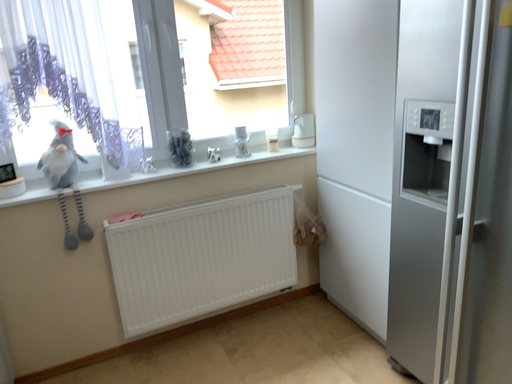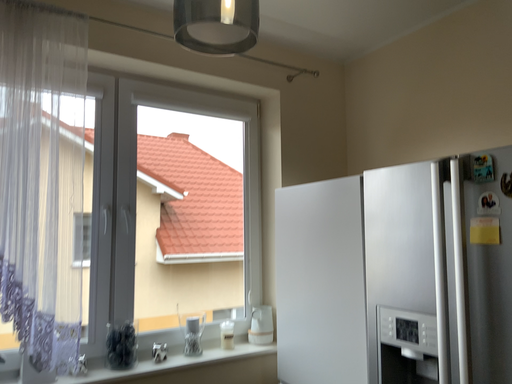
Question: Which way did the camera rotate in the video?

Choices:
 (A) rotated left
 (B) rotated right

Answer: (B)